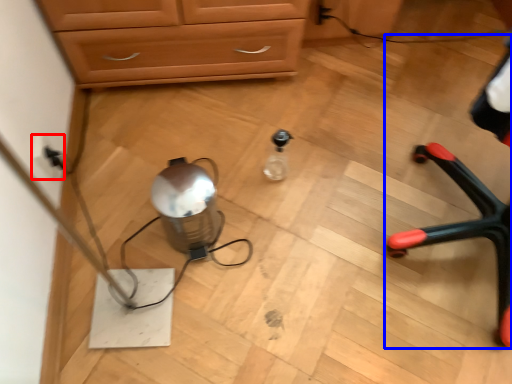
Question: Which object is further to the camera taking this photo, electric outlet (highlighted by a red box) or armchair (highlighted by a blue box)?

Choices:
 (A) electric outlet
 (B) armchair

Answer: (A)